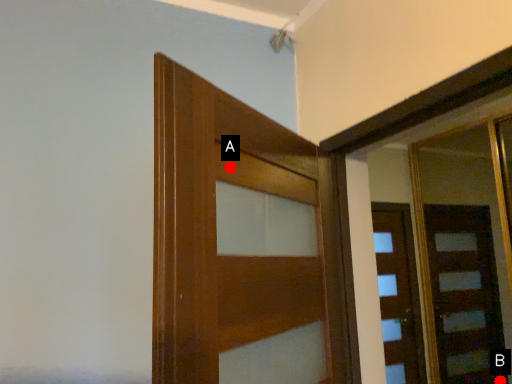
Question: Two points are circled on the image, labeled by A and B beside each circle. Which point is closer to the camera?

Choices:
 (A) A is closer
 (B) B is closer

Answer: (A)